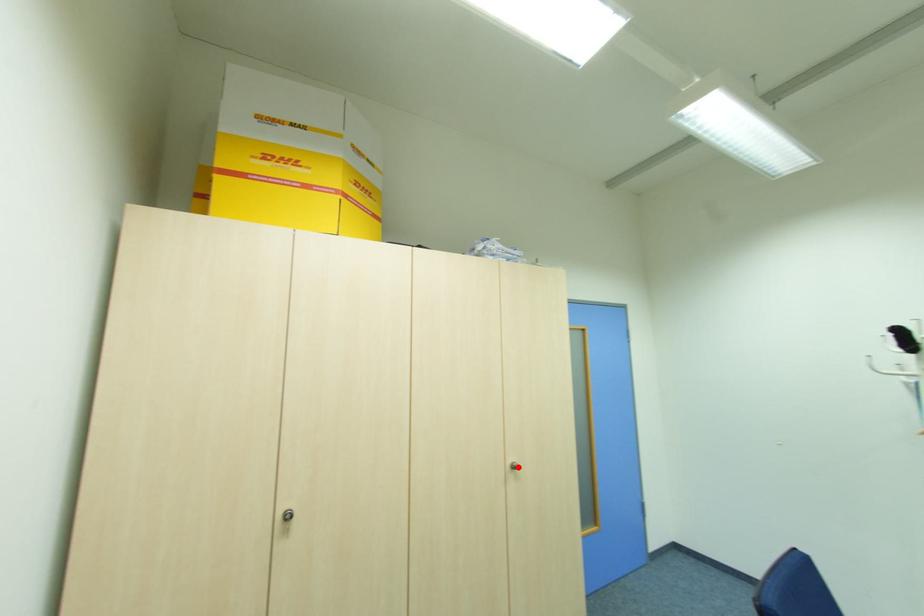
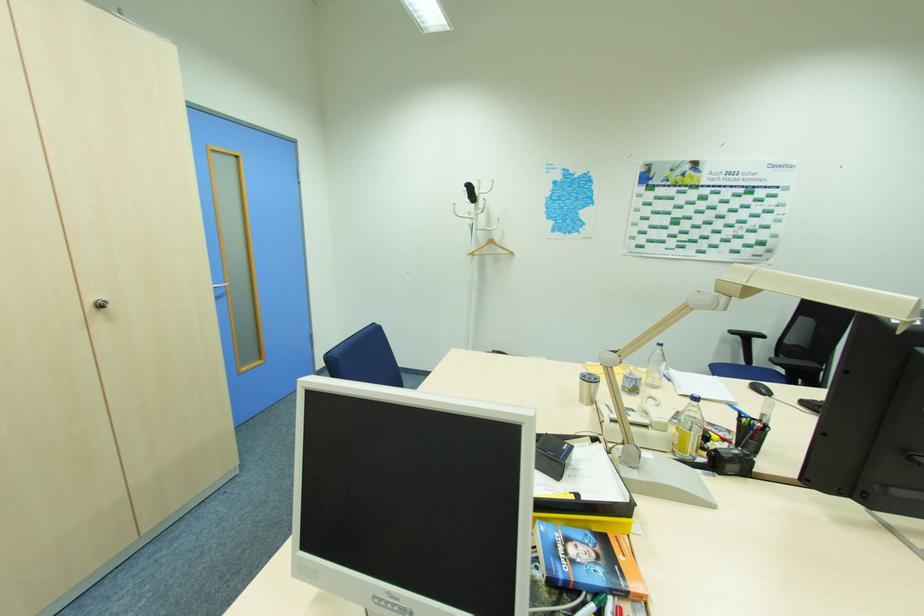
The point at the highlighted location is marked in the first image. Where is the corresponding point in the second image?

(103, 306)